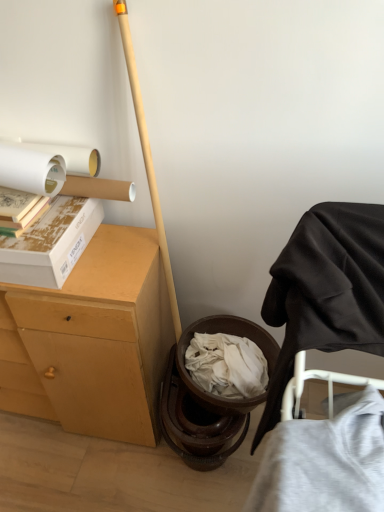
Question: From a real-world perspective, is black fabric chair at right on top of light brown wood desk at left?

Choices:
 (A) yes
 (B) no

Answer: (A)

Question: Does black fabric chair at right come in front of light brown wood desk at left?

Choices:
 (A) yes
 (B) no

Answer: (A)

Question: Is black fabric chair at right thinner than light brown wood desk at left?

Choices:
 (A) yes
 (B) no

Answer: (A)

Question: Is black fabric chair at right at the left side of light brown wood desk at left?

Choices:
 (A) no
 (B) yes

Answer: (A)

Question: Is black fabric chair at right not inside light brown wood desk at left?

Choices:
 (A) no
 (B) yes

Answer: (B)

Question: Is black fabric chair at right far away from light brown wood desk at left?

Choices:
 (A) yes
 (B) no

Answer: (B)

Question: Is black fabric chair at right closer to the viewer compared to matte cardboard book at upper left?

Choices:
 (A) no
 (B) yes

Answer: (B)

Question: Does black fabric chair at right have a larger size compared to matte cardboard book at upper left?

Choices:
 (A) no
 (B) yes

Answer: (B)

Question: Can you confirm if black fabric chair at right is wider than matte cardboard book at upper left?

Choices:
 (A) yes
 (B) no

Answer: (A)

Question: Can we say black fabric chair at right lies outside matte cardboard book at upper left?

Choices:
 (A) no
 (B) yes

Answer: (B)

Question: Is black fabric chair at right taller than matte cardboard book at upper left?

Choices:
 (A) yes
 (B) no

Answer: (A)

Question: From a real-world perspective, is black fabric chair at right under matte cardboard book at upper left?

Choices:
 (A) no
 (B) yes

Answer: (B)

Question: Considering the relative sizes of gray cotton t-shirt at lower right and black fabric chair at right in the image provided, is gray cotton t-shirt at lower right smaller than black fabric chair at right?

Choices:
 (A) yes
 (B) no

Answer: (A)